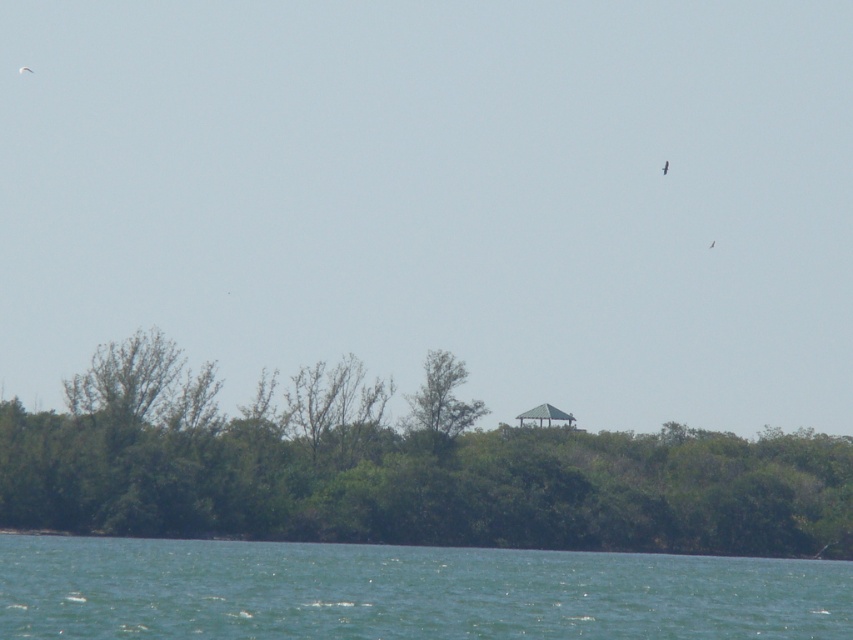
Can you confirm if green water at lower center is positioned above green leafy tree at center?

No, green water at lower center is not above green leafy tree at center.

Measure the distance between point (x=656, y=595) and camera.

A distance of 231.42 feet exists between point (x=656, y=595) and camera.

Locate an element on the screen. The image size is (853, 640). green water at lower center is located at coordinates (404, 592).

What do you see at coordinates (398, 470) in the screenshot? I see `green leafy trees at center` at bounding box center [398, 470].

Is point (792, 472) behind point (434, 449)?

That is True.

This screenshot has height=640, width=853. Describe the element at coordinates (398, 470) in the screenshot. I see `green leafy trees at center` at that location.

The image size is (853, 640). Identify the location of green leafy trees at center. (398, 470).

Does green leafy trees at center appear on the left side of green water at lower center?

Incorrect, green leafy trees at center is not on the left side of green water at lower center.

You are a GUI agent. You are given a task and a screenshot of the screen. Output one action in this format:
    pyautogui.click(x=<x>, y=<y>)
    Task: Click on the green leafy trees at center
    The image size is (853, 640).
    Given the screenshot: What is the action you would take?
    pyautogui.click(x=398, y=470)